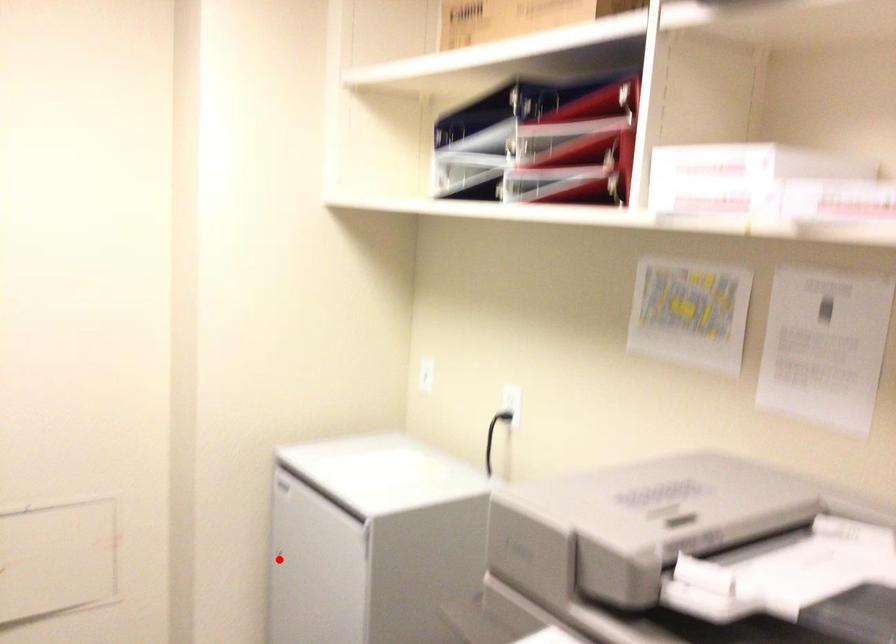
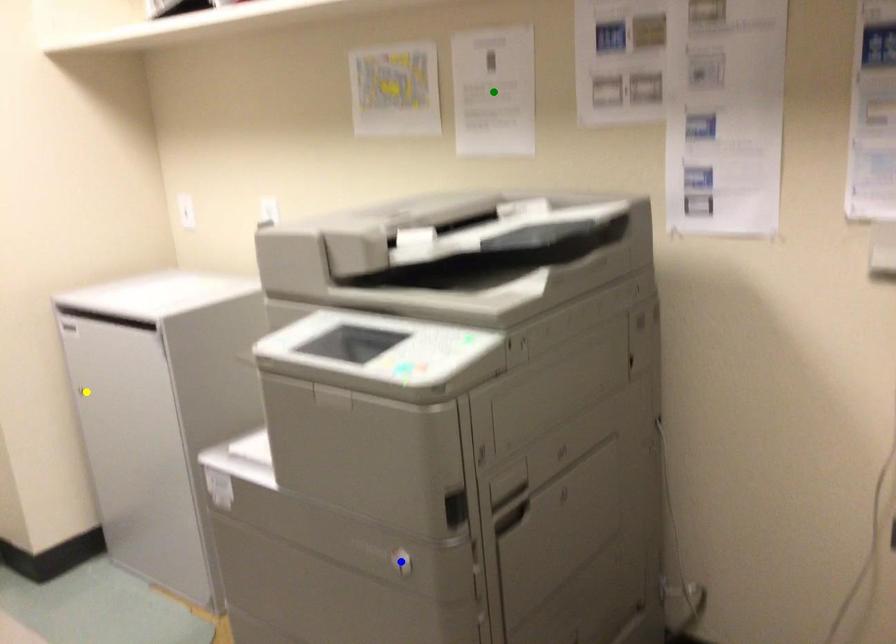
Question: I am providing you with two images of the same scene from different viewpoints. A red point is marked on the first image. You are given multiple points on the second image. Which point in image 2 is actually the same real-world point as the red point in image 1?

Choices:
 (A) blue point
 (B) yellow point
 (C) green point

Answer: (B)